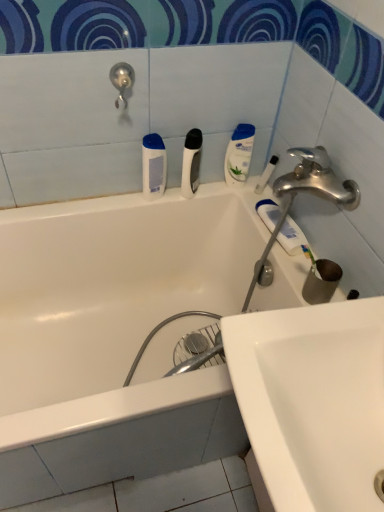
Question: Considering the positions of white glossy lotion at upper right, which is the second toiletry from right to left, and white matte bottle at upper center, which is the fourth toiletry from right to left, in the image, is white glossy lotion at upper right, which is the second toiletry from right to left, bigger or smaller than white matte bottle at upper center, which is the fourth toiletry from right to left,?

Choices:
 (A) big
 (B) small

Answer: (B)

Question: Does point (231, 184) appear closer or farther from the camera than point (155, 138)?

Choices:
 (A) closer
 (B) farther

Answer: (B)

Question: Which of these objects is positioned farthest from the white matte bottle at upper center, arranged as the first toiletry when viewed from the left?

Choices:
 (A) white glossy sink at lower right
 (B) white matte toothpaste at upper right
 (C) white matte razor at center, arranged as the 3th toiletry when viewed from the right
 (D) clear plastic toothbrush at upper right, marked as the fourth toiletry in a left-to-right arrangement
 (E) white glossy lotion at upper right, which is the second toiletry from right to left

Answer: (A)

Question: Considering the real-world distances, which object is closest to the white matte razor at center, arranged as the 3th toiletry when viewed from the right?

Choices:
 (A) clear plastic toothbrush at upper right, marked as the fourth toiletry in a left-to-right arrangement
 (B) white glossy lotion at upper right, the third toiletry from the left
 (C) white glossy bathtub at upper center
 (D) satin nickel showerhead at upper left
 (E) white matte toothpaste at upper right

Answer: (B)